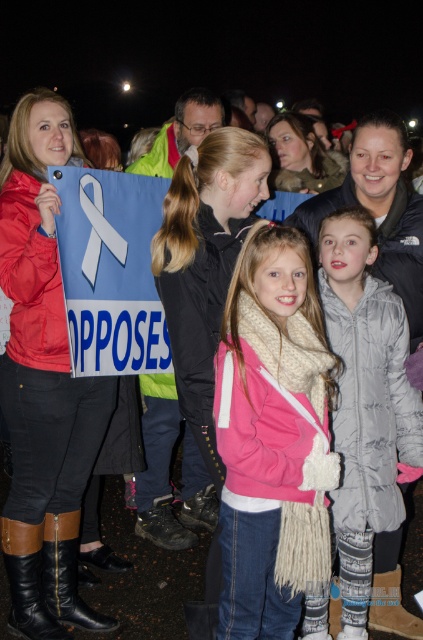
Can you confirm if white quilted jacket at center is positioned above black leather boot at lower left?

Yes, white quilted jacket at center is above black leather boot at lower left.

Is point (351, 627) behind point (80, 600)?

No, it is in front of (80, 600).

Find the location of a particular element. white quilted jacket at center is located at coordinates (368, 380).

Between pink fleece jacket at center and black leather boot at lower left, which one appears on the right side from the viewer's perspective?

pink fleece jacket at center

Is pink fleece jacket at center wider than black leather boot at lower left?

Correct, the width of pink fleece jacket at center exceeds that of black leather boot at lower left.

This screenshot has width=423, height=640. Describe the element at coordinates (272, 436) in the screenshot. I see `pink fleece jacket at center` at that location.

The height and width of the screenshot is (640, 423). Identify the location of pink fleece jacket at center. (272, 436).

Is brown leather boot at lower left shorter than brown suede boot at lower center?

In fact, brown leather boot at lower left may be taller than brown suede boot at lower center.

Is brown leather boot at lower left below brown suede boot at lower center?

Actually, brown leather boot at lower left is above brown suede boot at lower center.

This screenshot has height=640, width=423. Identify the location of brown leather boot at lower left. (27, 580).